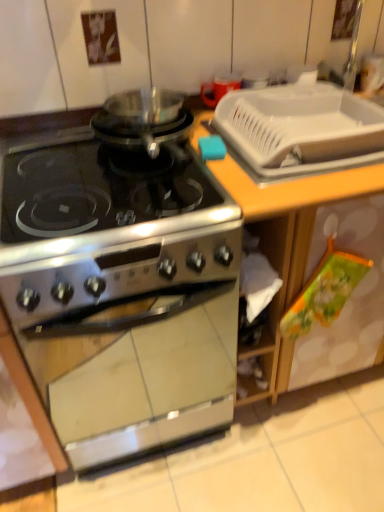
Question: Does white plastic sink at upper right have a lesser height compared to wooden countertop at center?

Choices:
 (A) no
 (B) yes

Answer: (B)

Question: From a real-world perspective, is white plastic sink at upper right below wooden countertop at center?

Choices:
 (A) yes
 (B) no

Answer: (B)

Question: Is white plastic sink at upper right oriented away from wooden countertop at center?

Choices:
 (A) yes
 (B) no

Answer: (B)

Question: Considering the relative positions of white plastic sink at upper right and wooden countertop at center in the image provided, is white plastic sink at upper right behind wooden countertop at center?

Choices:
 (A) yes
 (B) no

Answer: (A)

Question: Is white plastic sink at upper right closer to the viewer compared to wooden countertop at center?

Choices:
 (A) yes
 (B) no

Answer: (B)

Question: From the image's perspective, is white plastic sink at upper right located above wooden countertop at center?

Choices:
 (A) yes
 (B) no

Answer: (A)

Question: From a real-world perspective, is stainless steel stove at center on top of white plastic tray at upper right?

Choices:
 (A) yes
 (B) no

Answer: (B)

Question: Is stainless steel stove at center at the right side of white plastic tray at upper right?

Choices:
 (A) yes
 (B) no

Answer: (B)

Question: Considering the relative sizes of stainless steel stove at center and white plastic tray at upper right in the image provided, is stainless steel stove at center wider than white plastic tray at upper right?

Choices:
 (A) no
 (B) yes

Answer: (B)

Question: Is stainless steel stove at center to the left of white plastic tray at upper right from the viewer's perspective?

Choices:
 (A) no
 (B) yes

Answer: (B)

Question: Can we say stainless steel stove at center lies outside white plastic tray at upper right?

Choices:
 (A) no
 (B) yes

Answer: (B)

Question: From the image's perspective, is stainless steel stove at center located beneath white plastic tray at upper right?

Choices:
 (A) no
 (B) yes

Answer: (B)

Question: Does wooden countertop at center have a smaller size compared to white plastic tray at upper right?

Choices:
 (A) yes
 (B) no

Answer: (B)